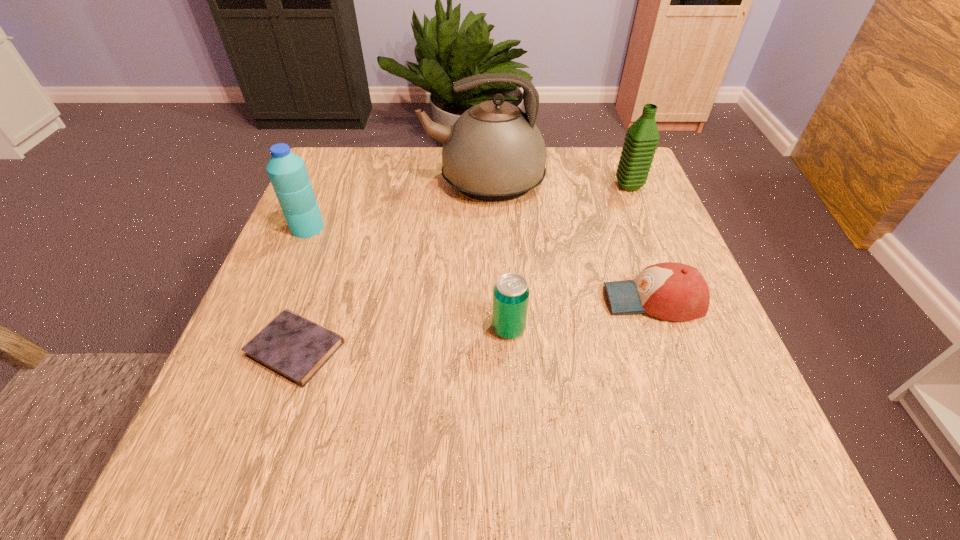
The image size is (960, 540). I want to click on diary that is at the left edge, so click(291, 346).

This screenshot has height=540, width=960. In order to click on water bottle positioned at the right edge in this screenshot , I will do [x=642, y=137].

Find the location of a particular element. This screenshot has width=960, height=540. baseball cap at the right edge is located at coordinates (671, 291).

Where is `object that is at the far right corner`? The image size is (960, 540). object that is at the far right corner is located at coordinates (642, 137).

At what (x,y) coordinates should I click in order to perform the action: click on vacant region at the far edge of the desktop. Please return your answer as a coordinate pair (x, y). Looking at the image, I should click on (380, 181).

Image resolution: width=960 pixels, height=540 pixels. I want to click on vacant space at the near edge, so click(654, 472).

Image resolution: width=960 pixels, height=540 pixels. In the image, there is a desktop. Identify the location of vacant space at the left edge. (301, 269).

Locate an element on the screen. The image size is (960, 540). vacant space at the right edge is located at coordinates (658, 225).

Image resolution: width=960 pixels, height=540 pixels. What are the coordinates of `vacant region at the near left corner of the desktop` in the screenshot? It's located at (228, 459).

This screenshot has width=960, height=540. What are the coordinates of `vacant space at the near right corner of the desktop` in the screenshot? It's located at (763, 478).